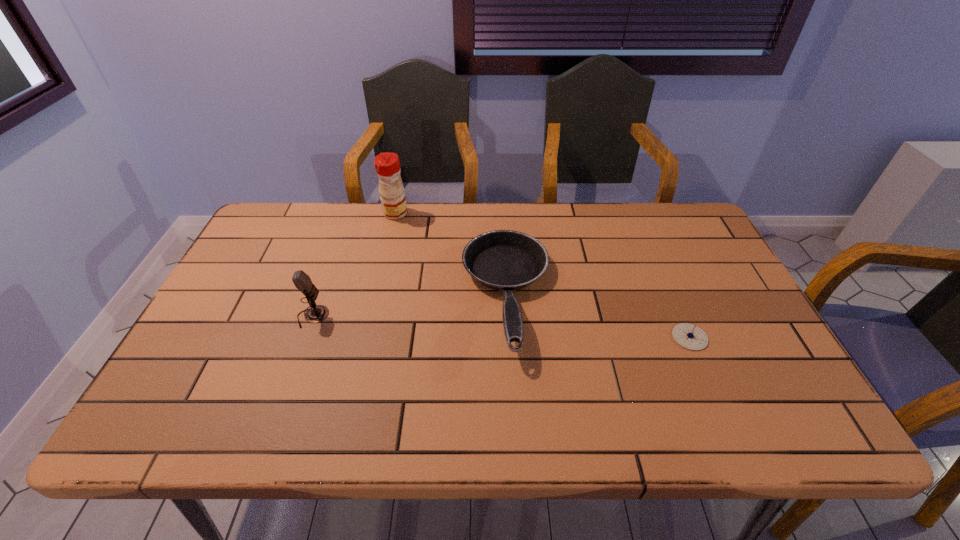
Where is `free space between the tallest object and the compass`? The height and width of the screenshot is (540, 960). free space between the tallest object and the compass is located at coordinates (542, 275).

Where is `free space between the microphone and the shortest object`? This screenshot has height=540, width=960. free space between the microphone and the shortest object is located at coordinates (501, 327).

Where is `vacant space that's between the farthest object and the third object from left to right`? The height and width of the screenshot is (540, 960). vacant space that's between the farthest object and the third object from left to right is located at coordinates [451, 254].

I want to click on free space between the leftmost object and the rightmost object, so click(x=501, y=327).

Identify the location of vacant area that lies between the frying pan and the compass. This screenshot has width=960, height=540. (598, 316).

Find the location of a particular element. free spot between the farthest object and the microphone is located at coordinates (354, 265).

Locate an element on the screen. The height and width of the screenshot is (540, 960). free space between the rightmost object and the third tallest object is located at coordinates (598, 316).

The width and height of the screenshot is (960, 540). I want to click on free space between the frying pan and the tallest object, so click(451, 254).

You are a GUI agent. You are given a task and a screenshot of the screen. Output one action in this format:
    pyautogui.click(x=<x>, y=<y>)
    Task: Click on the free space between the leftmost object and the compass
    This screenshot has height=540, width=960.
    Given the screenshot: What is the action you would take?
    pyautogui.click(x=501, y=327)

Locate an element on the screen. The width and height of the screenshot is (960, 540). free space between the frying pan and the rightmost object is located at coordinates (598, 316).